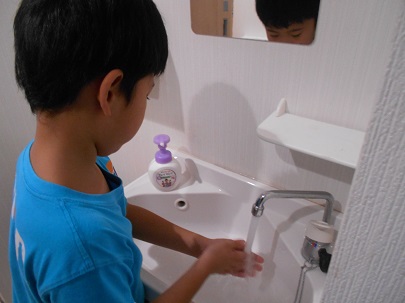
The height and width of the screenshot is (303, 405). What are the coordinates of `shelf` in the screenshot? It's located at (314, 136).